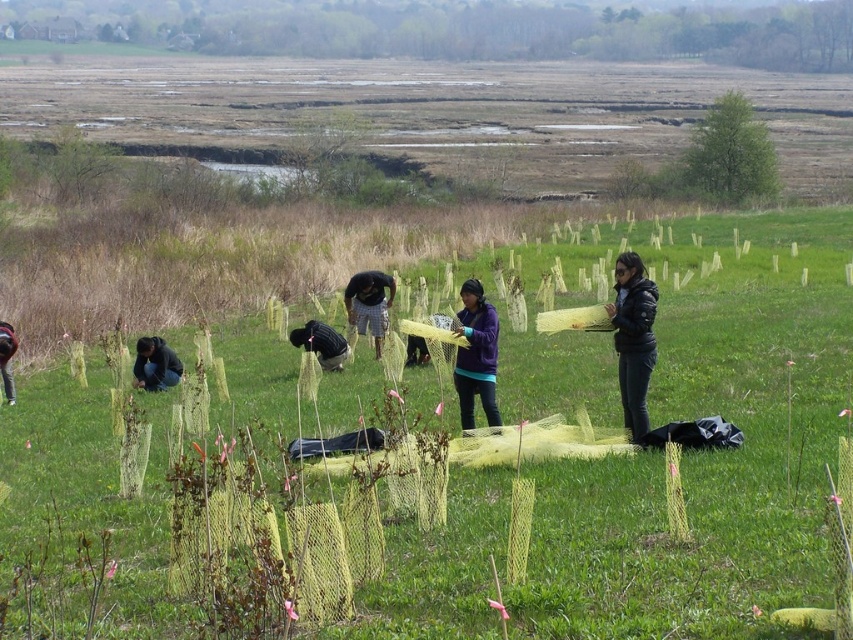
Question: Which object is closer to the camera taking this photo?

Choices:
 (A) dark gray pants at lower left
 (B) dark gray plaid shorts at center
 (C) green leafy tree at center

Answer: (A)

Question: Estimate the real-world distances between objects in this image. Which object is farther from the dark blue jacket at center?

Choices:
 (A) matte black jacket at lower left
 (B) dark gray plaid shorts at center

Answer: (A)

Question: Is black fabric bag at center positioned in front of dark blue jacket at center?

Choices:
 (A) yes
 (B) no

Answer: (A)

Question: Is black matte jacket at center positioned in front of dark gray pants at lower left?

Choices:
 (A) yes
 (B) no

Answer: (A)

Question: Can you confirm if black matte jacket at center is smaller than black fabric bag at center?

Choices:
 (A) no
 (B) yes

Answer: (B)

Question: Which object appears closest to the camera in this image?

Choices:
 (A) green leafy tree at upper right
 (B) black matte jacket at center

Answer: (B)